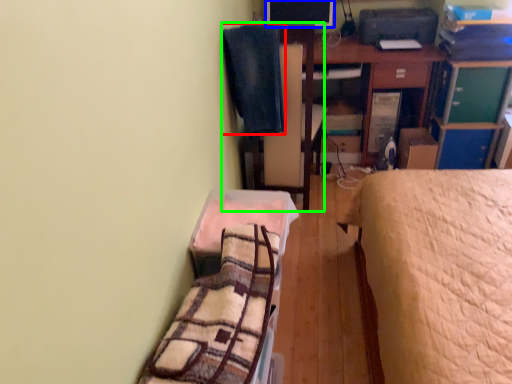
Question: Which object is the closest to the blanket (highlighted by a red box)? Choose among these: computer monitor (highlighted by a blue box) or swivel chair (highlighted by a green box).

Choices:
 (A) computer monitor
 (B) swivel chair

Answer: (B)